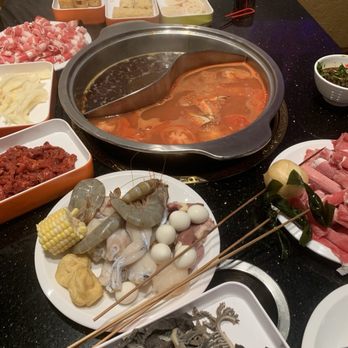
The height and width of the screenshot is (348, 348). Identify the location of ramekin. (174, 10), (142, 13), (80, 5), (38, 105), (74, 157).